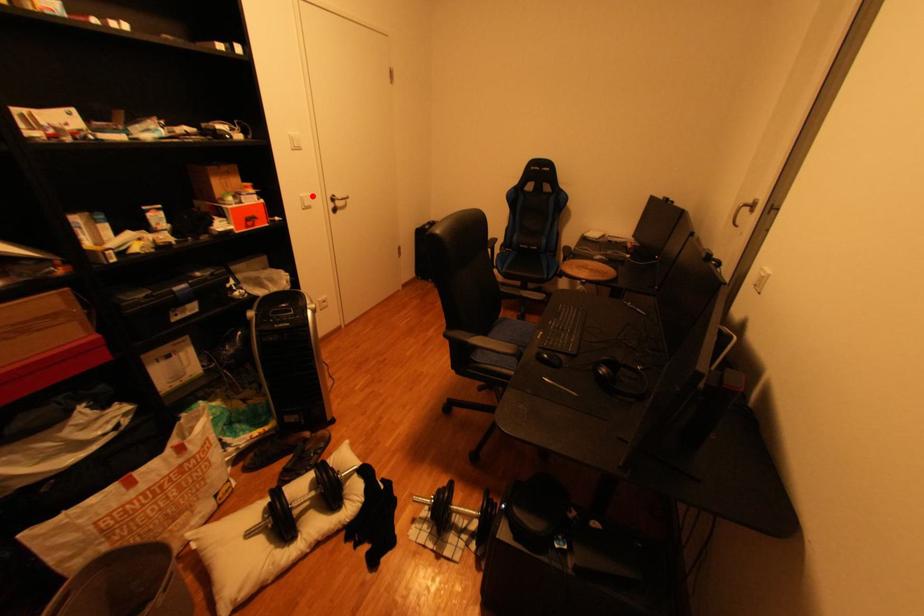
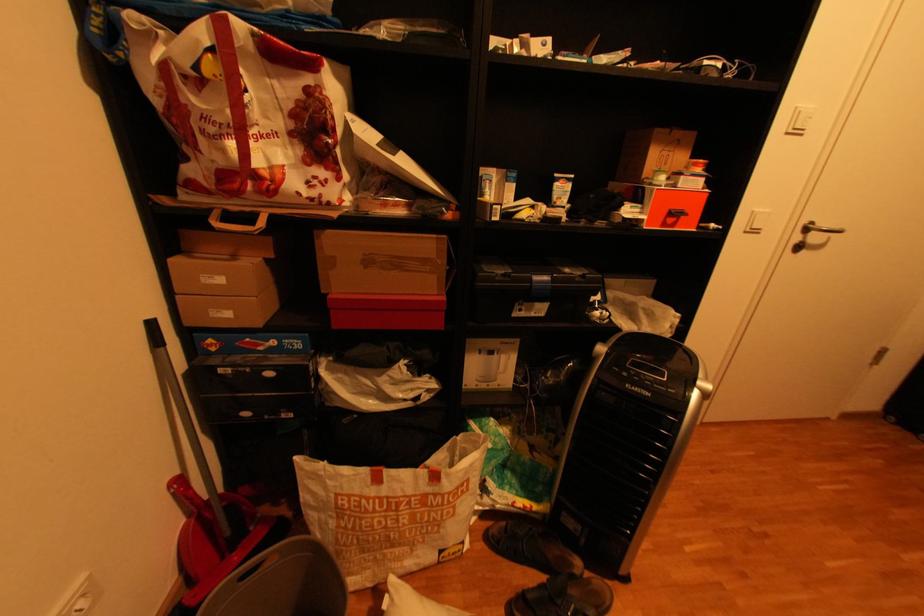
Question: I am providing you with two images of the same scene from different viewpoints. Image1 has a red point marked. In image2, the corresponding 3D location appears at what relative position? Reply with the corresponding letter.

Choices:
 (A) Closer
 (B) Farther

Answer: (B)